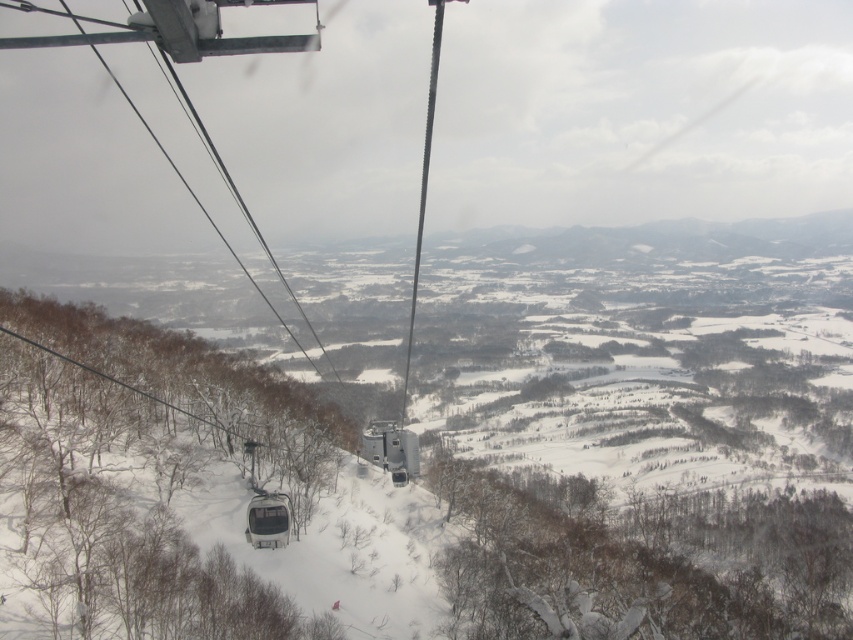
Can you confirm if white snow ski slope at center is positioned to the left of metallic cable car at center?

Indeed, white snow ski slope at center is positioned on the left side of metallic cable car at center.

Identify the location of white snow ski slope at center. The width and height of the screenshot is (853, 640). (451, 458).

The height and width of the screenshot is (640, 853). Identify the location of white snow ski slope at center. (451, 458).

Which is more to the right, white snow ski slope at center or metallic gray ski lift at center?

metallic gray ski lift at center is more to the right.

Between white snow ski slope at center and metallic gray ski lift at center, which one has less height?

Standing shorter between the two is metallic gray ski lift at center.

The height and width of the screenshot is (640, 853). What are the coordinates of `white snow ski slope at center` in the screenshot? It's located at (451, 458).

Can you confirm if white metallic ski lift at center is taller than metallic cable car at center?

Indeed, white metallic ski lift at center has a greater height compared to metallic cable car at center.

The height and width of the screenshot is (640, 853). What are the coordinates of `white metallic ski lift at center` in the screenshot? It's located at (184, 61).